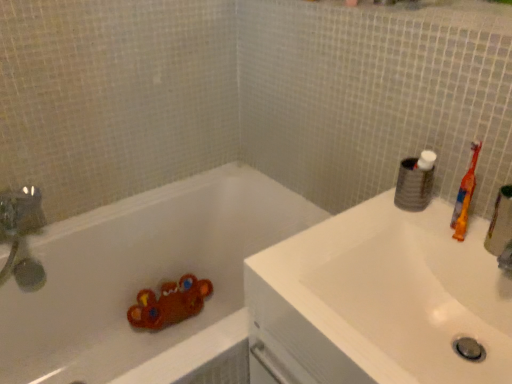
Locate an element on the screen. The image size is (512, 384). vacant space that is to the left of white matte toilet paper at upper right is located at coordinates pos(366,217).